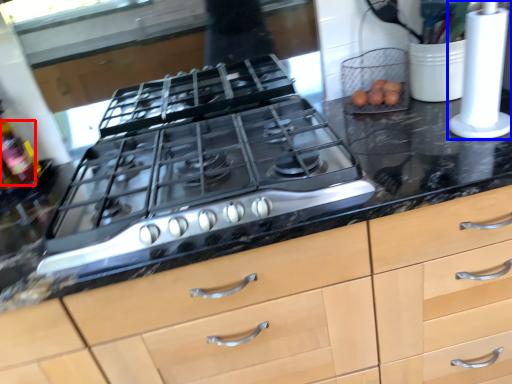
Question: Among these objects, which one is nearest to the camera, bottle (highlighted by a red box) or kitchen appliance (highlighted by a blue box)?

Choices:
 (A) bottle
 (B) kitchen appliance

Answer: (B)